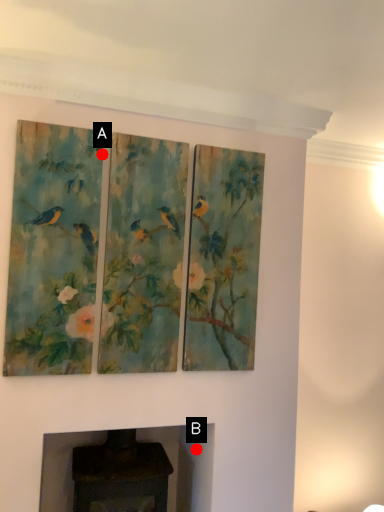
Question: Two points are circled on the image, labeled by A and B beside each circle. Among these points, which one is nearest to the camera?

Choices:
 (A) A is closer
 (B) B is closer

Answer: (A)